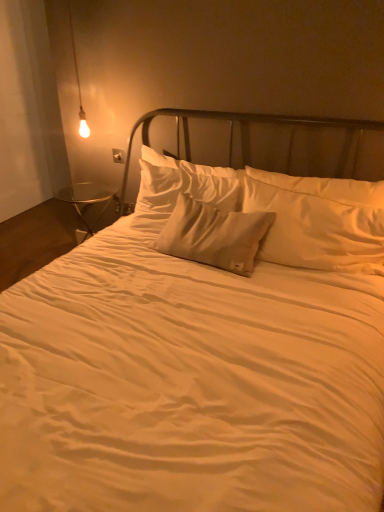
Question: Looking at the image, does matte plastic electric outlet at lower left, the second electric outlet from the top, seem bigger or smaller compared to matte glass bulb at upper left?

Choices:
 (A) small
 (B) big

Answer: (A)

Question: In the image, is matte plastic electric outlet at lower left, the second electric outlet from the top, positioned in front of or behind matte glass bulb at upper left?

Choices:
 (A) front
 (B) behind

Answer: (B)

Question: Estimate the real-world distances between objects in this image. Which object is farther from the satin beige pillow at center, placed as the 2th pillow when sorted from front to back?

Choices:
 (A) matte glass bulb at upper left
 (B) satin beige pillow at center, placed as the second pillow when sorted from back to front
 (C) white plastic electric outlet at upper left, the 2th electric outlet from the bottom
 (D) matte plastic electric outlet at lower left, the 2th electric outlet viewed from the front

Answer: (A)

Question: Which object is positioned closest to the matte plastic electric outlet at lower left, the 2th electric outlet viewed from the front?

Choices:
 (A) white plastic electric outlet at upper left, which is the 1th electric outlet from front to back
 (B) satin beige pillow at center, placed as the 2th pillow when sorted from front to back
 (C) matte glass bulb at upper left
 (D) satin beige pillow at center, which ranks as the first pillow in front-to-back order

Answer: (A)